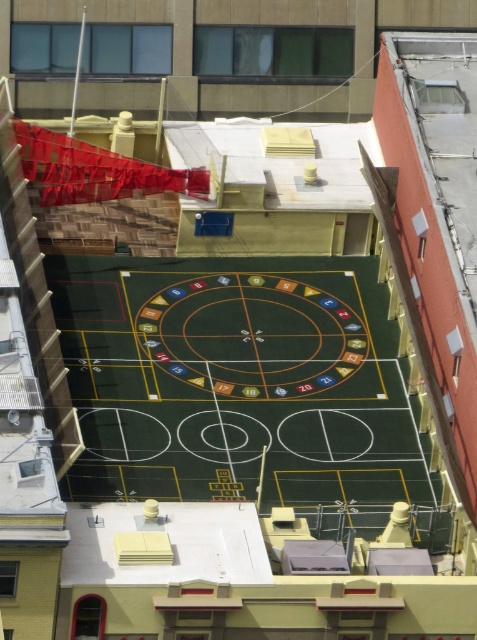
Is green rubber basketball court at center positioned before green felt roulette at center?

Yes.

How far apart are green rubber basketball court at center and green felt roulette at center?

A distance of 1.21 meters exists between green rubber basketball court at center and green felt roulette at center.

The width and height of the screenshot is (477, 640). What do you see at coordinates (244, 387) in the screenshot? I see `green rubber basketball court at center` at bounding box center [244, 387].

Locate an element on the screen. The height and width of the screenshot is (640, 477). green rubber basketball court at center is located at coordinates pyautogui.click(x=244, y=387).